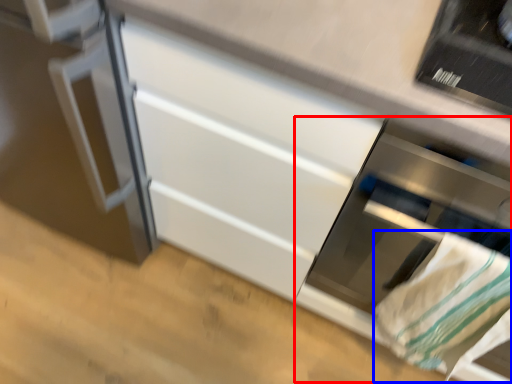
Question: Among these objects, which one is farthest to the camera, oven (highlighted by a red box) or blanket (highlighted by a blue box)?

Choices:
 (A) oven
 (B) blanket

Answer: (B)